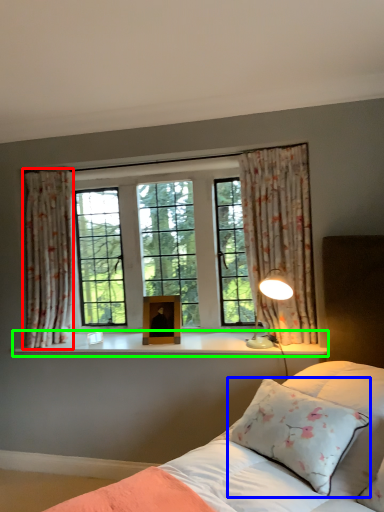
Question: Which object is the farthest from curtain (highlighted by a red box)? Choose among these: pillow (highlighted by a blue box) or window sill (highlighted by a green box).

Choices:
 (A) pillow
 (B) window sill

Answer: (A)